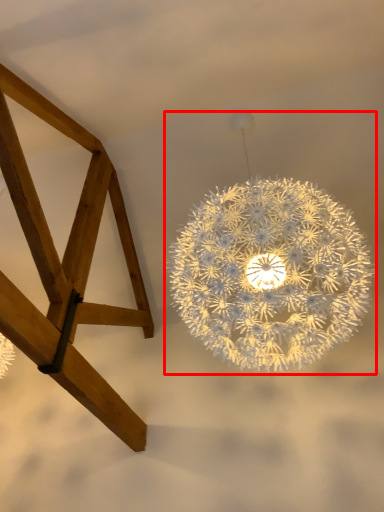
Question: From the image's perspective, where is lamp (annotated by the red box) located in relation to furniture in the image?

Choices:
 (A) below
 (B) above

Answer: (B)